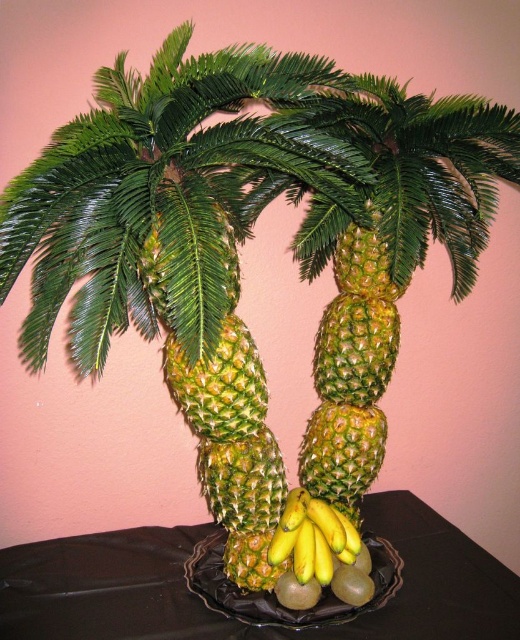
Does black plastic tray at center lie behind yellow smooth bananas at center?

No, it is not.

Who is more forward, [227,636] or [335,554]?

Point [227,636]

What are the coordinates of `black plastic tray at center` in the screenshot? It's located at (236, 620).